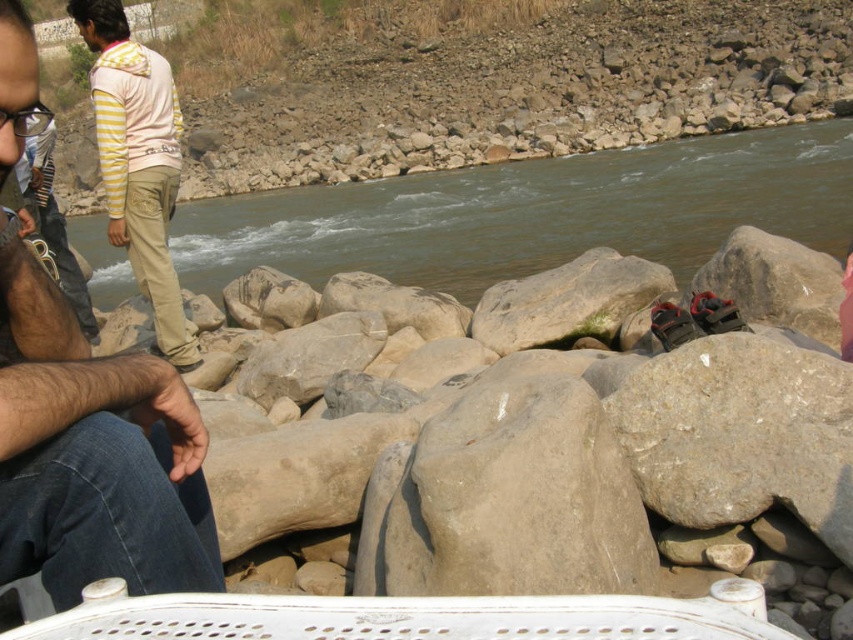
Does greenish-brown water at center come behind beige cotton pants at center?

Yes, greenish-brown water at center is further from the viewer.

Which is behind, point (675, 166) or point (38, 461)?

The point (675, 166) is more distant.

This screenshot has height=640, width=853. Describe the element at coordinates (532, 212) in the screenshot. I see `greenish-brown water at center` at that location.

I want to click on greenish-brown water at center, so click(x=532, y=212).

Can you confirm if beige cotton pants at center is wider than light pink hoodie at upper left?

Incorrect, beige cotton pants at center's width does not surpass light pink hoodie at upper left's.

Locate an element on the screen. beige cotton pants at center is located at coordinates (93, 452).

How far apart are greenish-brown water at center and light pink hoodie at upper left?

18.61 meters

Is point (543, 260) in front of point (190, 349)?

No.

I want to click on greenish-brown water at center, so click(x=532, y=212).